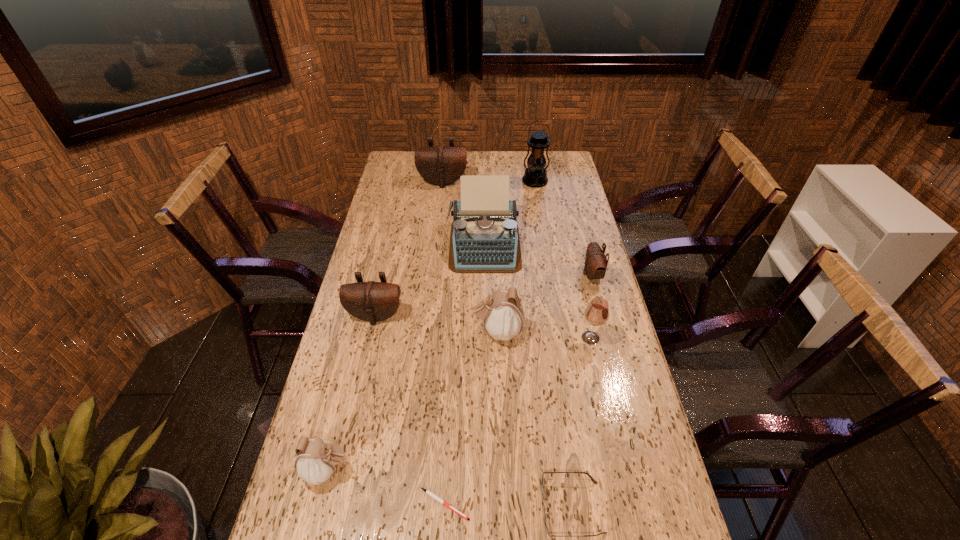
Locate an element on the screen. The height and width of the screenshot is (540, 960). the nearer white pouch is located at coordinates (316, 460).

The image size is (960, 540). I want to click on the rightmost pouch, so click(596, 262).

Image resolution: width=960 pixels, height=540 pixels. What are the coordinates of `the smallest brown pouch` in the screenshot? It's located at (596, 262).

Locate an element on the screen. The image size is (960, 540). the shortest object is located at coordinates (428, 492).

Identify the location of white pen. Image resolution: width=960 pixels, height=540 pixels. (428, 492).

Identify some points in free space located above the black lantern, indicating its light source. Please provide its 2D coordinates. Your answer should be formatted as a tuple, i.e. [(x, y)], where the tuple contains the x and y coordinates of a point satisfying the conditions above.

[(546, 247)]

I want to click on vacant area situated on the typing side of the blue typewriter, so click(485, 316).

At what (x,y) coordinates should I click in order to perform the action: click on vacant space situated with the flap open on the biggest brown pouch. Please return your answer as a coordinate pair (x, y). Image resolution: width=960 pixels, height=540 pixels. Looking at the image, I should click on (438, 226).

The width and height of the screenshot is (960, 540). Find the location of `vacant space located on the front-facing side of the fourth pouch from left to right`. vacant space located on the front-facing side of the fourth pouch from left to right is located at coordinates (397, 332).

At what (x,y) coordinates should I click in order to perform the action: click on free point located 0.170m on the front-facing side of the fourth pouch from left to right. Please return your answer as a coordinate pair (x, y). This screenshot has height=540, width=960. Looking at the image, I should click on (417, 332).